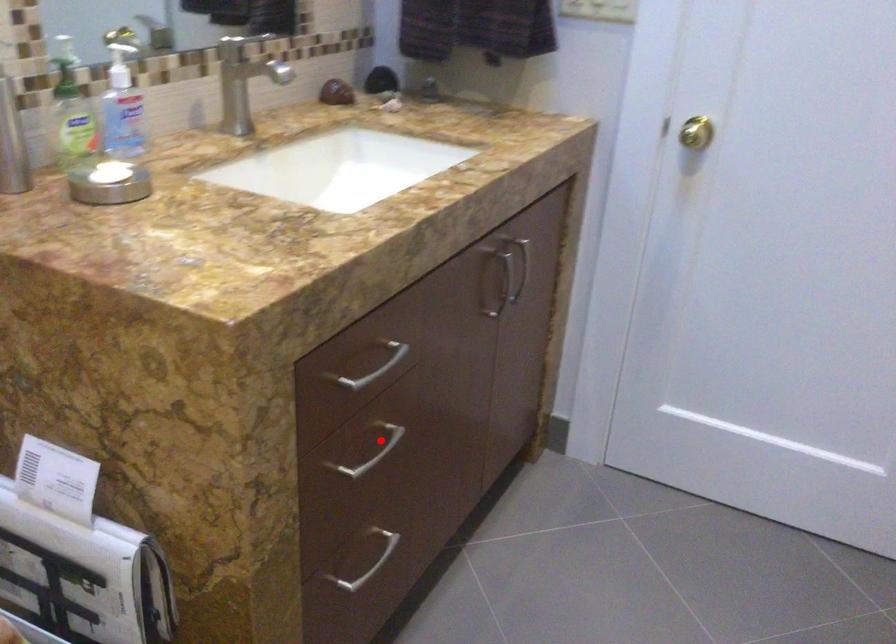
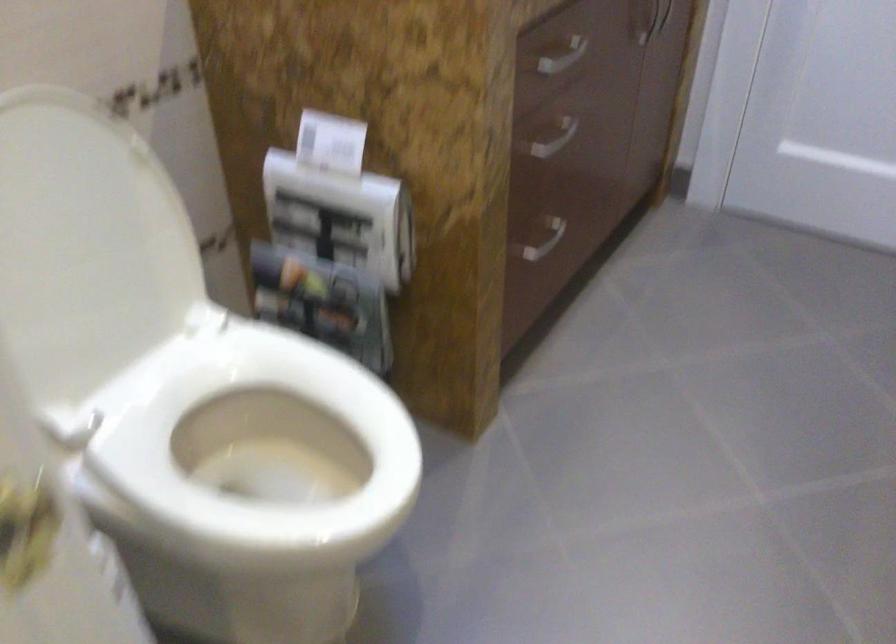
Question: A red point is marked in image1. In image2, is the corresponding 3D point closer to the camera or farther? Reply with the corresponding letter.

Choices:
 (A) The corresponding 3D point is closer.
 (B) The corresponding 3D point is farther.

Answer: (B)